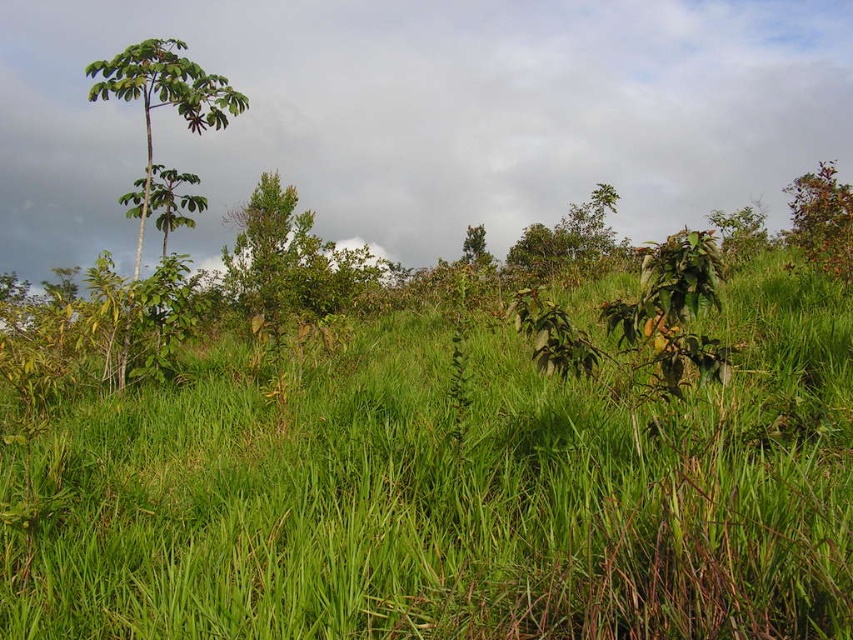
Is green grassy at center below green leafy shrub at upper right?

Yes.

Is point (842, 556) less distant than point (825, 232)?

Yes, it is.

Where is `green grassy at center`? green grassy at center is located at coordinates (461, 497).

Locate an element on the screen. The width and height of the screenshot is (853, 640). green grassy at center is located at coordinates (461, 497).

Between green grassy at center and green leafy tree at left, which one appears on the right side from the viewer's perspective?

From the viewer's perspective, green grassy at center appears more on the right side.

Which is above, green grassy at center or green leafy tree at left?

green leafy tree at left is higher up.

Between point (173, 440) and point (93, 96), which one is positioned in front?

Positioned in front is point (173, 440).

Locate an element on the screen. The width and height of the screenshot is (853, 640). green grassy at center is located at coordinates (461, 497).

From the picture: Can you confirm if green leafy tree at left is thinner than green leafy shrub at upper right?

Correct, green leafy tree at left's width is less than green leafy shrub at upper right's.

Can you confirm if green leafy tree at left is positioned to the left of green leafy shrub at upper right?

Yes, green leafy tree at left is to the left of green leafy shrub at upper right.

From the picture: Who is more forward, (141, 44) or (844, 221)?

Point (141, 44) is more forward.

Find the location of a particular element. This screenshot has height=640, width=853. green leafy tree at left is located at coordinates (163, 97).